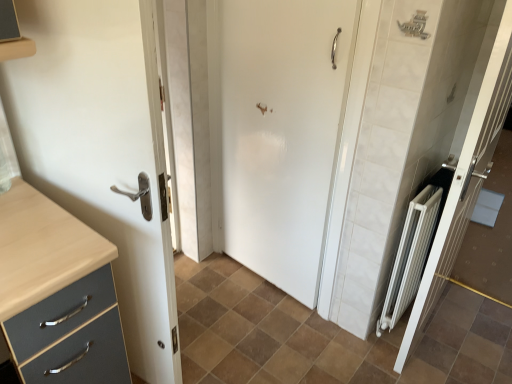
At what (x,y) coordinates should I click in order to perform the action: click on free region on the left part of white metallic radiator at right, marked as the third door in a left-to-right arrangement. Please return your answer as a coordinate pair (x, y). This screenshot has height=384, width=512. Looking at the image, I should click on (335, 350).